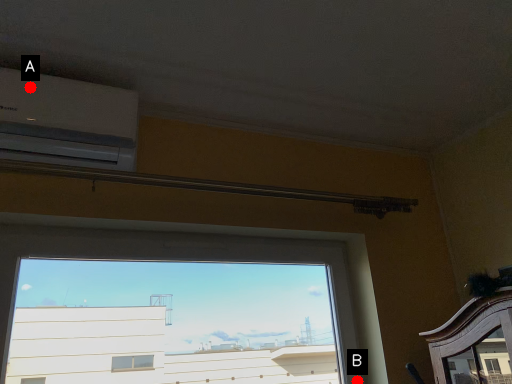
Question: Two points are circled on the image, labeled by A and B beside each circle. Which of the following is the farthest from the observer?

Choices:
 (A) A is further
 (B) B is further

Answer: (B)